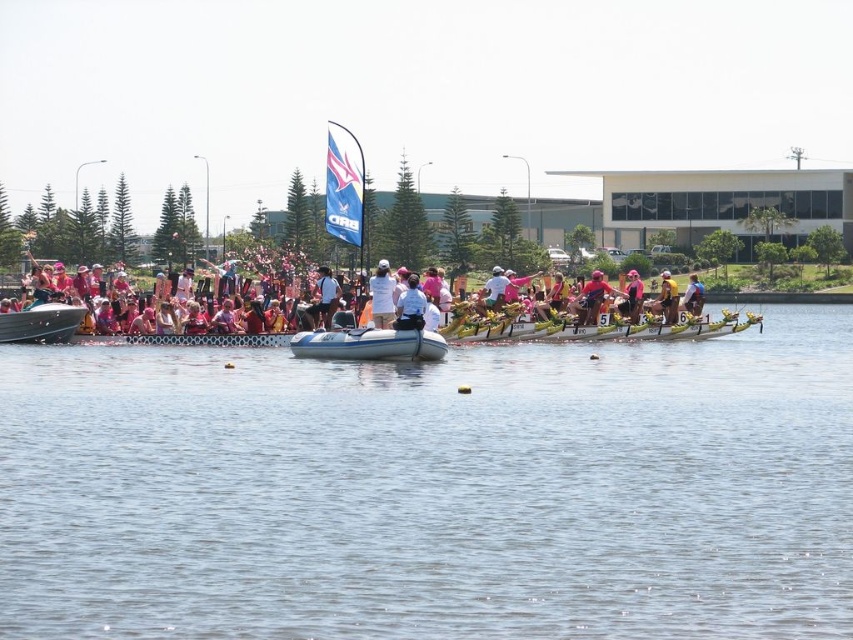
You are a participant in the dragon boat race and need to determine the best spot to place your team photo. Since the clear water at center and the white cotton shirt at center are both visible in the scene, which one should you choose as the background to make the photo look more spacious?

The clear water at center is larger in size than the white cotton shirt at center, so choosing the clear water at center as the background would make the photo look more spacious.

You are a participant in the dragon boat race and you see the white cloth at center and the pink fabric person at center. Which object is higher in the image?

The white cloth at center is above the pink fabric person at center, so the white cloth at center is higher in the image.

You are a photographer standing at the edge of the water, and you want to capture a clear photo of the white cotton shirt at center. Based on the scene, can you determine if the distance is within your camera lens range? Your camera has a maximum zoom range of 300 feet.

The white cotton shirt at center is 315.60 feet away from the viewer. Since the camera has a maximum zoom range of 300 feet, the distance is beyond the camera lens range, so capturing a clear photo might not be possible.